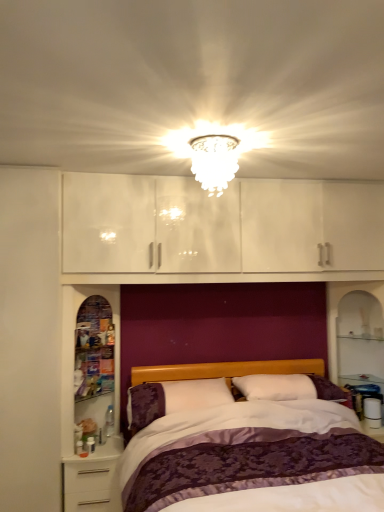
Question: Does purple satin bed at center have a greater width compared to white soft pillow at center?

Choices:
 (A) yes
 (B) no

Answer: (A)

Question: From a real-world perspective, does purple satin bed at center sit lower than white soft pillow at center?

Choices:
 (A) yes
 (B) no

Answer: (A)

Question: From the image's perspective, is purple satin bed at center under white soft pillow at center?

Choices:
 (A) no
 (B) yes

Answer: (B)

Question: Is purple satin bed at center in front of white soft pillow at center?

Choices:
 (A) yes
 (B) no

Answer: (A)

Question: Would you say purple satin bed at center is a long distance from white soft pillow at center?

Choices:
 (A) no
 (B) yes

Answer: (A)

Question: Is transparent glass cabinet at left in front of or behind white glossy nightstand at lower left in the image?

Choices:
 (A) front
 (B) behind

Answer: (B)

Question: From a real-world perspective, is transparent glass cabinet at left positioned above or below white glossy nightstand at lower left?

Choices:
 (A) above
 (B) below

Answer: (A)

Question: Is transparent glass cabinet at left taller or shorter than white glossy nightstand at lower left?

Choices:
 (A) short
 (B) tall

Answer: (B)

Question: Is transparent glass cabinet at left to the left or to the right of white glossy nightstand at lower left in the image?

Choices:
 (A) right
 (B) left

Answer: (B)

Question: Does point (357, 493) appear closer or farther from the camera than point (77, 490)?

Choices:
 (A) closer
 (B) farther

Answer: (A)

Question: Is purple satin bed at center taller or shorter than white glossy nightstand at lower left?

Choices:
 (A) tall
 (B) short

Answer: (A)

Question: Is purple satin bed at center in front of or behind white glossy nightstand at lower left in the image?

Choices:
 (A) behind
 (B) front

Answer: (B)

Question: From a real-world perspective, is purple satin bed at center above or below white glossy nightstand at lower left?

Choices:
 (A) below
 (B) above

Answer: (B)

Question: Considering the relative positions of white soft pillow at center and purple satin bed at center in the image provided, is white soft pillow at center to the left or to the right of purple satin bed at center?

Choices:
 (A) right
 (B) left

Answer: (B)

Question: From a real-world perspective, relative to purple satin bed at center, is white soft pillow at center vertically above or below?

Choices:
 (A) above
 (B) below

Answer: (A)